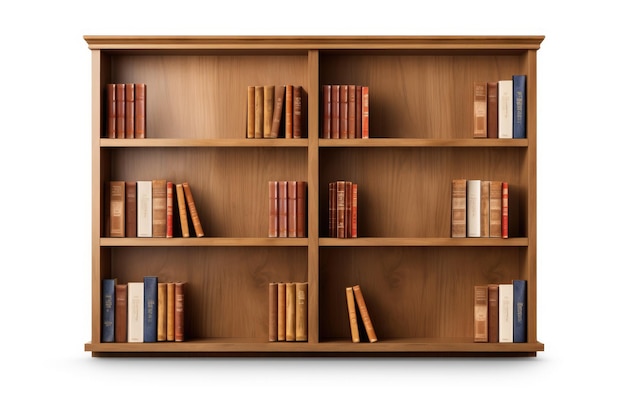
Identify the location of books on middle right shelf. This screenshot has width=626, height=393. (506, 207), (494, 219), (485, 208), (471, 216), (454, 217), (354, 195), (347, 205), (340, 209), (331, 210).